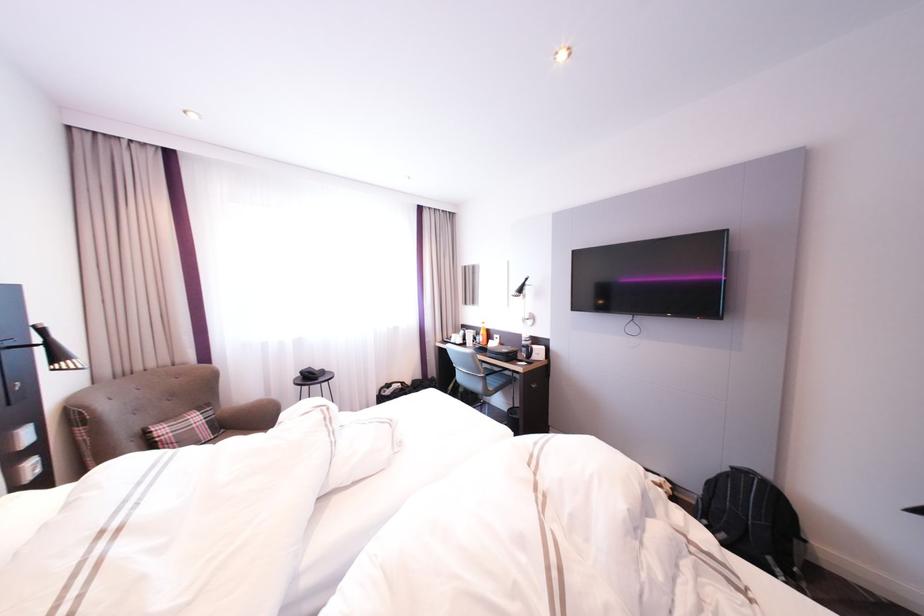
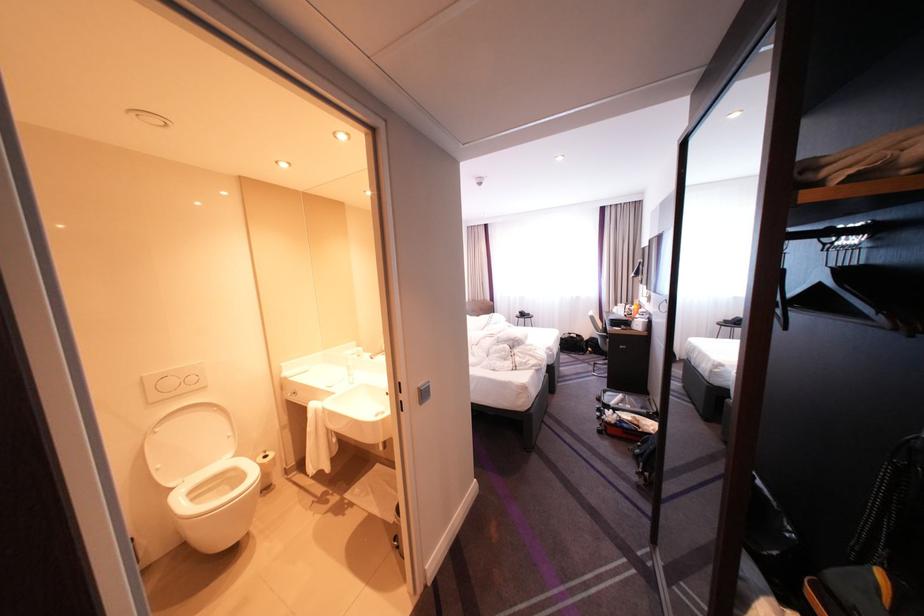
Find the pixel in the second image that matches point (420, 383) in the first image.

(599, 338)